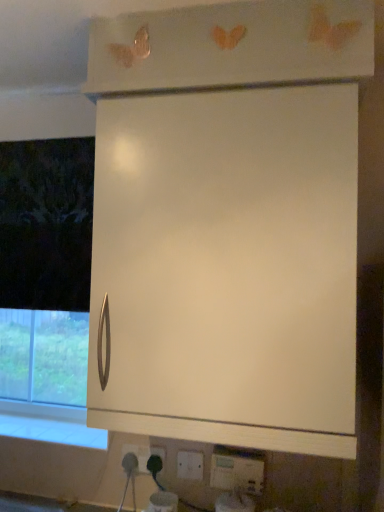
Question: Can you see white plastic electric outlet at lower center, which appears as the 2th electric outlet when viewed from the back, touching white matte cabinet at center?

Choices:
 (A) no
 (B) yes

Answer: (A)

Question: Is white plastic electric outlet at lower center, marked as the second electric outlet in a left-to-right arrangement, positioned in front of white matte cabinet at center?

Choices:
 (A) no
 (B) yes

Answer: (A)

Question: Is white plastic electric outlet at lower center, the second electric outlet when ordered from front to back, not near white matte cabinet at center?

Choices:
 (A) no
 (B) yes

Answer: (A)

Question: From the image's perspective, would you say white plastic electric outlet at lower center, which appears as the 2th electric outlet when viewed from the back, is positioned over white matte cabinet at center?

Choices:
 (A) yes
 (B) no

Answer: (B)

Question: Considering the relative sizes of white plastic electric outlet at lower center, the second electric outlet when ordered from front to back, and white matte cabinet at center in the image provided, is white plastic electric outlet at lower center, the second electric outlet when ordered from front to back, thinner than white matte cabinet at center?

Choices:
 (A) no
 (B) yes

Answer: (B)

Question: Does point 26,418 appear closer or farther from the camera than point 142,468?

Choices:
 (A) farther
 (B) closer

Answer: (A)

Question: From the image's perspective, is white glossy window sill at lower left above or below white plastic socket at lower center, arranged as the first electric outlet when viewed from the left?

Choices:
 (A) above
 (B) below

Answer: (A)

Question: From a real-world perspective, is white glossy window sill at lower left physically located above or below white plastic socket at lower center, the 1th electric outlet in the back-to-front sequence?

Choices:
 (A) below
 (B) above

Answer: (B)

Question: Considering the relative positions of white glossy window sill at lower left and white plastic socket at lower center, the 1th electric outlet in the back-to-front sequence, in the image provided, is white glossy window sill at lower left to the left or to the right of white plastic socket at lower center, the 1th electric outlet in the back-to-front sequence,?

Choices:
 (A) left
 (B) right

Answer: (A)

Question: Choose the correct answer: Is white matte cabinet at center inside white plastic electric outlet at lower center, which appears as the 2th electric outlet when viewed from the back, or outside it?

Choices:
 (A) outside
 (B) inside

Answer: (A)

Question: From a real-world perspective, is white matte cabinet at center positioned above or below white plastic electric outlet at lower center, which ranks as the 2th electric outlet in right-to-left order?

Choices:
 (A) below
 (B) above

Answer: (B)

Question: Looking at the image, does white matte cabinet at center seem bigger or smaller compared to white plastic electric outlet at lower center, the second electric outlet when ordered from front to back?

Choices:
 (A) big
 (B) small

Answer: (A)

Question: From the image's perspective, is white matte cabinet at center above or below white plastic electric outlet at lower center, marked as the second electric outlet in a left-to-right arrangement?

Choices:
 (A) below
 (B) above

Answer: (B)

Question: From a real-world perspective, relative to white glossy window sill at lower left, is white matte cabinet at center vertically above or below?

Choices:
 (A) above
 (B) below

Answer: (A)

Question: Looking at their shapes, would you say white matte cabinet at center is wider or thinner than white glossy window sill at lower left?

Choices:
 (A) thin
 (B) wide

Answer: (B)